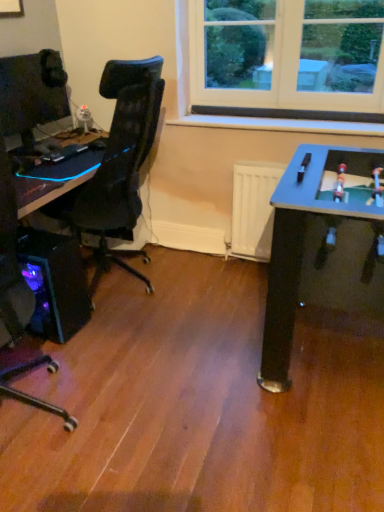
Question: Is white plastic toy at upper center spatially inside matte black monitor at left, or outside of it?

Choices:
 (A) outside
 (B) inside

Answer: (A)

Question: From a real-world perspective, relative to matte black monitor at left, is white plastic toy at upper center vertically above or below?

Choices:
 (A) below
 (B) above

Answer: (A)

Question: Considering the real-world distances, which object is closest to the translucent purple plastic computer tower at lower left?

Choices:
 (A) black plastic desk at left
 (B) matte black monitor at left
 (C) white plastic toy at upper center

Answer: (A)

Question: Estimate the real-world distances between objects in this image. Which object is closer to the black plastic desk at left?

Choices:
 (A) translucent purple plastic computer tower at lower left
 (B) matte black monitor at left
 (C) white plastic toy at upper center

Answer: (A)